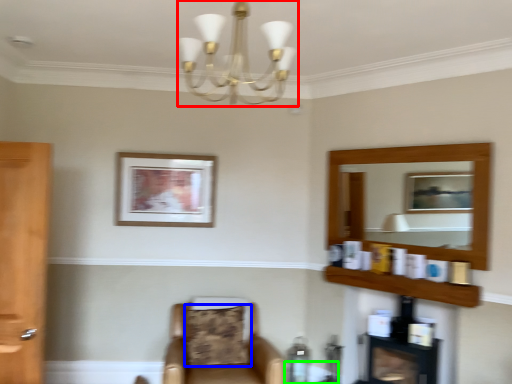
Question: Estimate the real-world distances between objects in this image. Which object is closer to light fixture (highlighted by a red box), pillow (highlighted by a blue box) or round table (highlighted by a green box)?

Choices:
 (A) pillow
 (B) round table

Answer: (A)